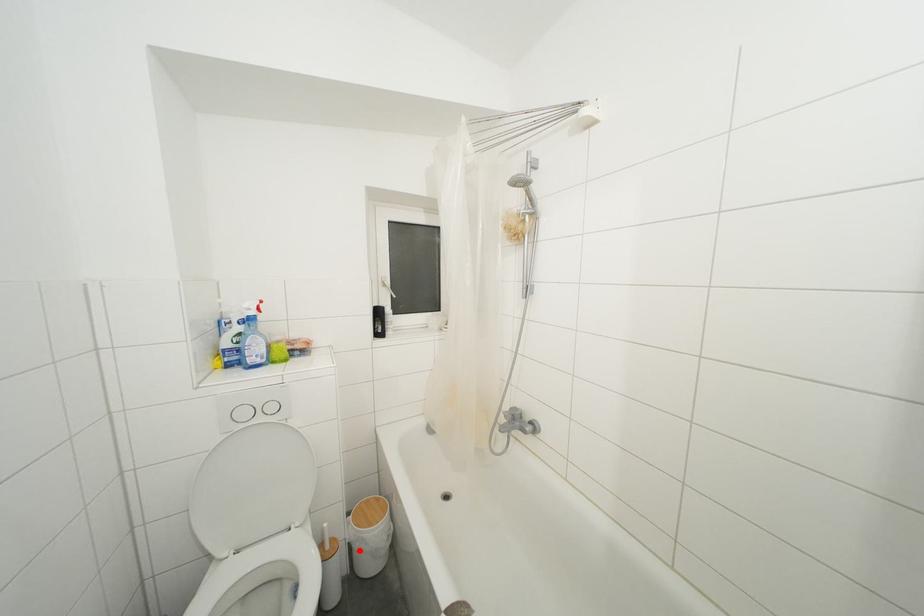
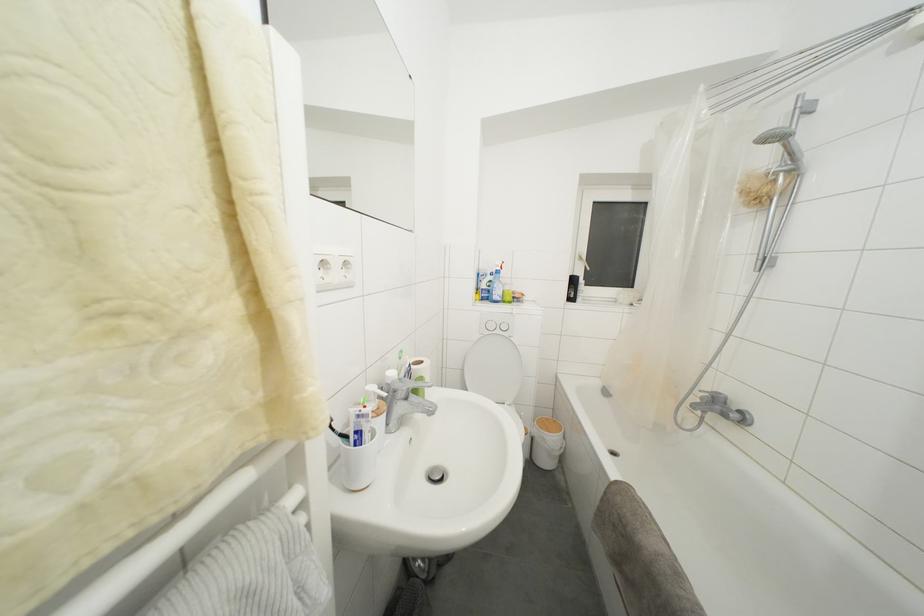
Question: I am providing you with two images of the same scene from different viewpoints. Given a red point in image1, look at the same physical point in image2. Is it:

Choices:
 (A) Closer to the viewpoint
 (B) Farther from the viewpoint

Answer: (B)